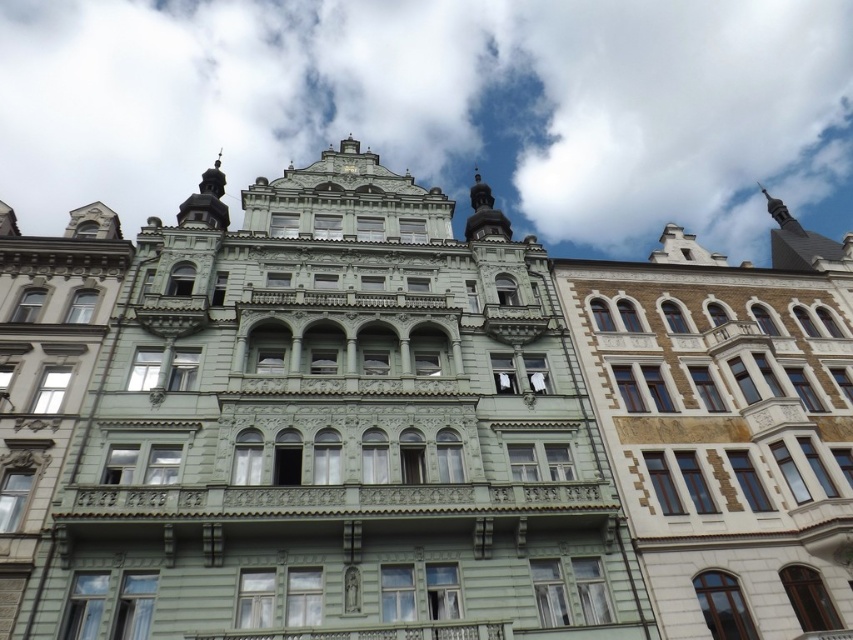
Is white fluffy cloud at upper center smaller than gold textured clock at upper center?

No.

Who is shorter, white fluffy cloud at upper center or gold textured clock at upper center?

With less height is gold textured clock at upper center.

Is point (96, 38) farther from viewer compared to point (345, 172)?

Yes, it is.

You are a GUI agent. You are given a task and a screenshot of the screen. Output one action in this format:
    pyautogui.click(x=<x>, y=<y>)
    Task: Click on the white fluffy cloud at upper center
    This screenshot has width=853, height=640.
    Given the screenshot: What is the action you would take?
    pyautogui.click(x=444, y=108)